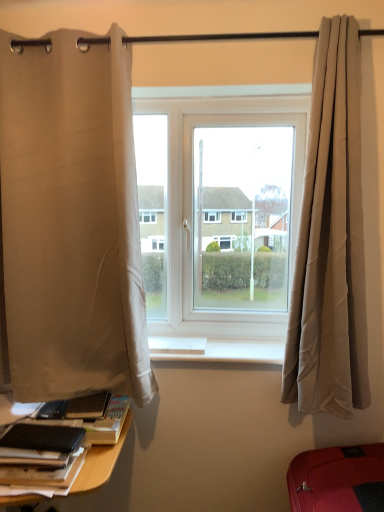
Find the location of a particular element. white fabric curtain at left, the first curtain viewed from the left is located at coordinates (71, 219).

The image size is (384, 512). What do you see at coordinates (39, 454) in the screenshot?
I see `black matte book at lower left` at bounding box center [39, 454].

The width and height of the screenshot is (384, 512). In order to click on rubberized red suitcase at lower right in this screenshot , I will do point(336,479).

Consider the image. Is rubberized red suitcase at lower right directly adjacent to white smooth window sill at center?

There is a gap between rubberized red suitcase at lower right and white smooth window sill at center.

Is rubberized red suitcase at lower right aimed at white smooth window sill at center?

No, rubberized red suitcase at lower right does not turn towards white smooth window sill at center.

Can you confirm if rubberized red suitcase at lower right is wider than white smooth window sill at center?

Indeed, rubberized red suitcase at lower right has a greater width compared to white smooth window sill at center.

Where is `window sill below the beige fabric curtain at right, the first curtain from the right (from a real-world perspective)`? This screenshot has height=512, width=384. window sill below the beige fabric curtain at right, the first curtain from the right (from a real-world perspective) is located at coordinates (215, 350).

Looking at their sizes, would you say white smooth window sill at center is wider or thinner than beige fabric curtain at right, the first curtain from the right?

Considering their sizes, white smooth window sill at center looks broader than beige fabric curtain at right, the first curtain from the right.

Would you consider white smooth window sill at center to be distant from beige fabric curtain at right, the 2th curtain when ordered from left to right?

No, white smooth window sill at center is not far away from beige fabric curtain at right, the 2th curtain when ordered from left to right.

Can you tell me how much white smooth window sill at center and beige fabric curtain at right, the first curtain from the right, differ in facing direction?

white smooth window sill at center and beige fabric curtain at right, the first curtain from the right, are facing 0.00481 degrees away from each other.

Can you see white fabric curtain at left, the first curtain viewed from the left, touching white smooth window sill at center?

No, white fabric curtain at left, the first curtain viewed from the left, is not touching white smooth window sill at center.

Does point (15, 269) come closer to viewer compared to point (198, 350)?

Yes.

In terms of width, does white fabric curtain at left, the second curtain from the right, look wider or thinner when compared to white smooth window sill at center?

white fabric curtain at left, the second curtain from the right, is thinner than white smooth window sill at center.

From the image's perspective, is white fabric curtain at left, the first curtain viewed from the left, located above or below white smooth window sill at center?

white fabric curtain at left, the first curtain viewed from the left, is situated higher than white smooth window sill at center in the image.

Is black matte book at lower left surrounded by white plastic window at center?

No, black matte book at lower left is not a part of white plastic window at center.

Does white plastic window at center appear on the left side of black matte book at lower left?

No, white plastic window at center is not to the left of black matte book at lower left.

Considering the relative sizes of white plastic window at center and black matte book at lower left in the image provided, is white plastic window at center wider than black matte book at lower left?

No.

Is white plastic window at center aimed at black matte book at lower left?

No, white plastic window at center is not aimed at black matte book at lower left.

From the image's perspective, is white smooth window sill at center located above or below rubberized red suitcase at lower right?

Clearly, from the image's perspective, white smooth window sill at center is above rubberized red suitcase at lower right.

Could you tell me if white smooth window sill at center is facing rubberized red suitcase at lower right?

No, white smooth window sill at center does not turn towards rubberized red suitcase at lower right.

Is white smooth window sill at center in front of or behind rubberized red suitcase at lower right in the image?

Clearly, white smooth window sill at center is behind rubberized red suitcase at lower right.

Does black matte book at lower left have a lesser height compared to white plastic window at center?

Correct, black matte book at lower left is not as tall as white plastic window at center.

Considering the relative positions of black matte book at lower left and white plastic window at center in the image provided, is black matte book at lower left to the left of white plastic window at center from the viewer's perspective?

Correct, you'll find black matte book at lower left to the left of white plastic window at center.

Can you confirm if black matte book at lower left is bigger than white plastic window at center?

Actually, black matte book at lower left might be smaller than white plastic window at center.

From the picture: Which is in front, black matte book at lower left or white plastic window at center?

black matte book at lower left is more forward.

From the image's perspective, which one is positioned higher, white fabric curtain at left, the second curtain from the right, or beige fabric curtain at right, the 2th curtain when ordered from left to right?

white fabric curtain at left, the second curtain from the right, from the image's perspective.

Is white fabric curtain at left, the second curtain from the right, looking in the opposite direction of beige fabric curtain at right, the first curtain from the right?

No, white fabric curtain at left, the second curtain from the right, is not facing the opposite direction of beige fabric curtain at right, the first curtain from the right.

How distant is white fabric curtain at left, the second curtain from the right, from beige fabric curtain at right, the first curtain from the right?

white fabric curtain at left, the second curtain from the right, is 31.31 inches away from beige fabric curtain at right, the first curtain from the right.

Does white fabric curtain at left, the first curtain viewed from the left, lie in front of beige fabric curtain at right, the 2th curtain when ordered from left to right?

No, white fabric curtain at left, the first curtain viewed from the left, is further to the viewer.

The height and width of the screenshot is (512, 384). I want to click on window sill above the rubberized red suitcase at lower right (from the image's perspective), so click(x=215, y=350).

Locate an element on the screen. window sill below the beige fabric curtain at right, the first curtain from the right (from the image's perspective) is located at coordinates pos(215,350).

From the picture: Estimate the real-world distances between objects in this image. Which object is further from rubberized red suitcase at lower right, white fabric curtain at left, the first curtain viewed from the left, or white smooth window sill at center?

white fabric curtain at left, the first curtain viewed from the left, is positioned further to the anchor rubberized red suitcase at lower right.

Considering their positions, is rubberized red suitcase at lower right positioned closer to white smooth window sill at center than beige fabric curtain at right, the 2th curtain when ordered from left to right?

beige fabric curtain at right, the 2th curtain when ordered from left to right, is positioned closer to the anchor white smooth window sill at center.

From the image, which object appears to be nearer to white plastic window at center, beige fabric curtain at right, the 2th curtain when ordered from left to right, or black matte book at lower left?

beige fabric curtain at right, the 2th curtain when ordered from left to right.

From the image, which object appears to be farther from white smooth window sill at center, black matte book at lower left or beige fabric curtain at right, the 2th curtain when ordered from left to right?

Based on the image, black matte book at lower left appears to be further to white smooth window sill at center.

When comparing their distances from rubberized red suitcase at lower right, does white fabric curtain at left, the first curtain viewed from the left, or beige fabric curtain at right, the 2th curtain when ordered from left to right, seem further?

white fabric curtain at left, the first curtain viewed from the left, lies further to rubberized red suitcase at lower right than the other object.

From the image, which object appears to be nearer to rubberized red suitcase at lower right, beige fabric curtain at right, the 2th curtain when ordered from left to right, or white plastic window at center?

beige fabric curtain at right, the 2th curtain when ordered from left to right, is closer to rubberized red suitcase at lower right.

Based on their spatial positions, is white smooth window sill at center or white fabric curtain at left, the second curtain from the right, further from black matte book at lower left?

Based on the image, white fabric curtain at left, the second curtain from the right, appears to be further to black matte book at lower left.

When comparing their distances from white plastic window at center, does black matte book at lower left or beige fabric curtain at right, the 2th curtain when ordered from left to right, seem closer?

Based on the image, beige fabric curtain at right, the 2th curtain when ordered from left to right, appears to be nearer to white plastic window at center.

Image resolution: width=384 pixels, height=512 pixels. What are the coordinates of `window sill between white fabric curtain at left, the second curtain from the right, and black matte book at lower left from top to bottom` in the screenshot? It's located at (215, 350).

Locate an element on the screen. The height and width of the screenshot is (512, 384). curtain between white fabric curtain at left, the second curtain from the right, and rubberized red suitcase at lower right vertically is located at coordinates (330, 240).

You are a GUI agent. You are given a task and a screenshot of the screen. Output one action in this format:
    pyautogui.click(x=<x>, y=<y>)
    Task: Click on the window sill between white plastic window at center and rubberized red suitcase at lower right vertically
    
    Given the screenshot: What is the action you would take?
    pyautogui.click(x=215, y=350)

Where is `curtain between black matte book at lower left and beige fabric curtain at right, the first curtain from the right`? curtain between black matte book at lower left and beige fabric curtain at right, the first curtain from the right is located at coordinates (71, 219).